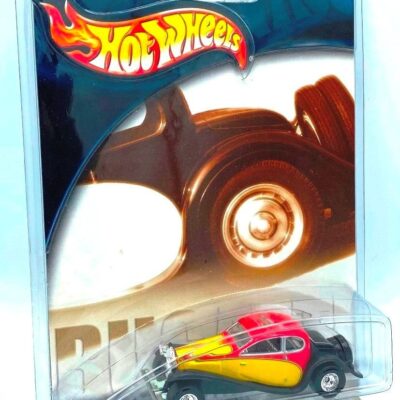
Locate an element on the screen. The height and width of the screenshot is (400, 400). yellow paint is located at coordinates (252, 370), (207, 344).